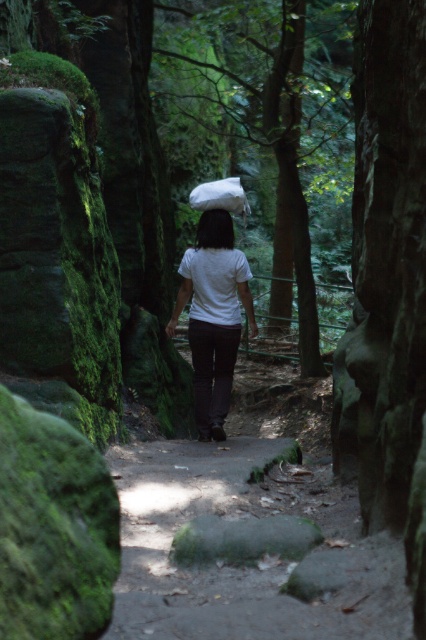
Who is more distant from viewer, (x=146, y=486) or (x=204, y=436)?

Point (x=204, y=436)

Is smooth dirt path at center above white matte shirt at center?

Incorrect, smooth dirt path at center is not positioned above white matte shirt at center.

This screenshot has height=640, width=426. Identify the location of smooth dirt path at center. (259, 550).